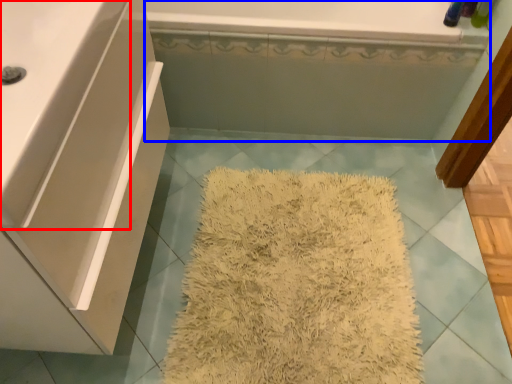
Question: Which object is closer to the camera taking this photo, counter top (highlighted by a red box) or bath (highlighted by a blue box)?

Choices:
 (A) counter top
 (B) bath

Answer: (A)